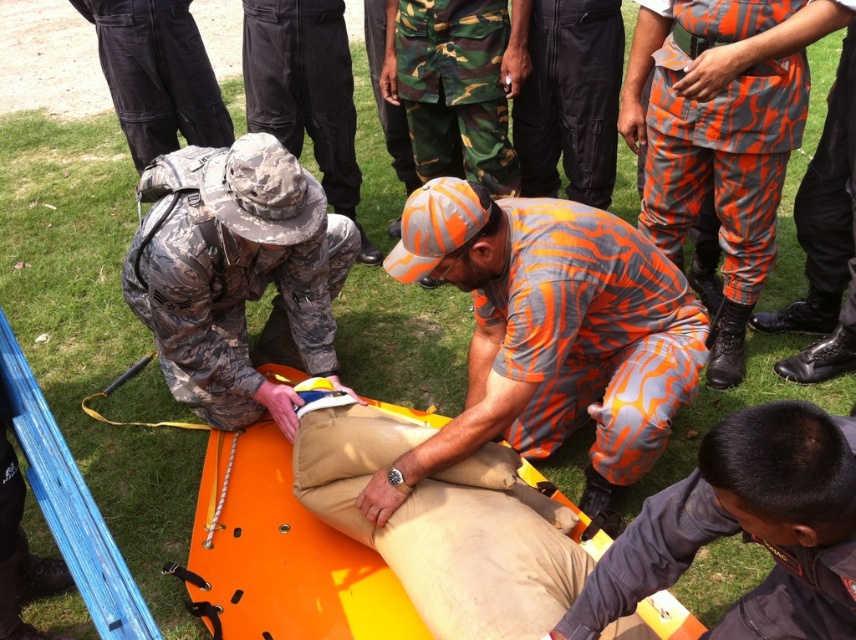
You are a photographer positioned at the center of the scene. You need to take a photo of the camouflage fabric uniform at left. Where should you aim your camera?

You should aim your camera at point (235, 273) to capture the camouflage fabric uniform at left.

Consider the image. You are an observer at the training exercise. You notice two individuals at the center wearing pants of different colors. Which pair of pants, the orange camouflage pants at center or the black cotton pants at center, would you say is bigger in size?

The orange camouflage pants at center is larger in size than the black cotton pants at center.

You are an observer watching the emergency response training. You notice two people in uniforms. The first is wearing an orange camouflage uniform at center, and the second is in a camouflage fabric uniform at left. Which of these two individuals is taller?

The orange camouflage uniform at center is taller than the camouflage fabric uniform at left.